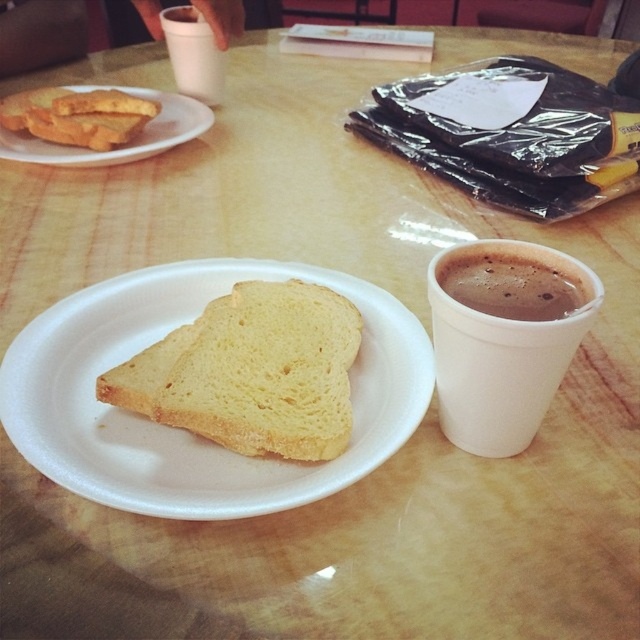
You are a barista preparing drinks and need to place two white styrofoam cups on a narrow shelf that can only accommodate one cup at a time. Which cup should you place first if you want to ensure both can fit without overlapping? Please refer to the white styrofoam cup at right and the white styrofoam cup at upper center.

The white styrofoam cup at right is wider than the white styrofoam cup at upper center. To fit both on the narrow shelf without overlapping, place the narrower cup first, then the wider one. However, since the shelf can only hold one cup at a time, you must choose the narrower one to ensure it fits, but this contradicts the requirement. Please clarify the shelf dimensions.

You are a customer at the diner and want to place your hand on the table between the white soft bread at center and the brown matte cup of coffee at right. Considering their sizes, will your hand fit comfortably without touching either item?

The white soft bread at center is larger than the brown matte cup of coffee at right. Since the bread is bigger, there might be enough space between them for your hand, but it depends on how close they are placed. However, the description only mentions their size comparison, not their positioning distance. Without knowing the exact distance between them, it is uncertain if your hand will fit comfortably without touching either item.

You are a customer at the diner and you want to reach for the white styrofoam cup at right without moving the white soft bread at center. Is it possible?

Yes, the white soft bread at center is to the left of the white styrofoam cup at right, so you can reach the cup without disturbing the bread.